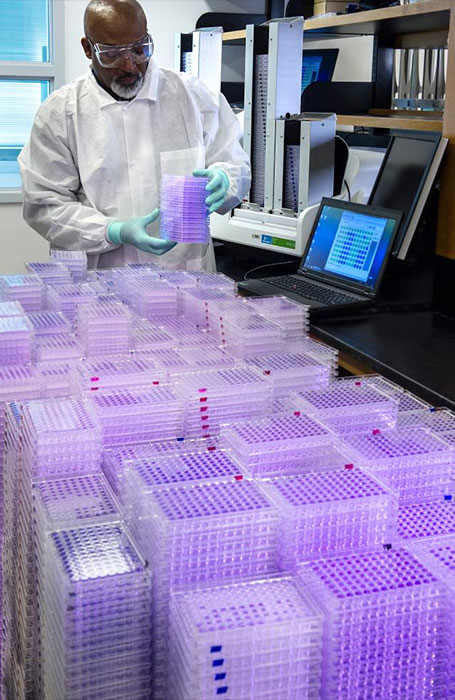
Locate an element on the screen. This screenshot has width=455, height=700. computer screen is located at coordinates (357, 243).